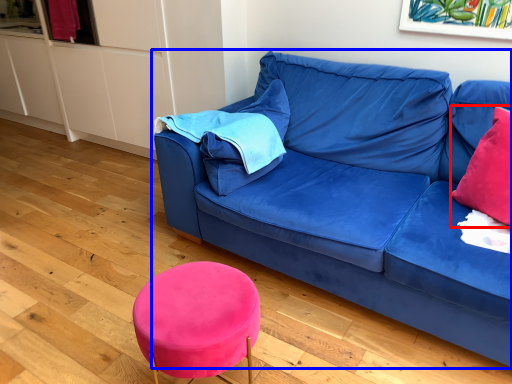
Question: Among these objects, which one is farthest to the camera, throw pillow (highlighted by a red box) or studio couch (highlighted by a blue box)?

Choices:
 (A) throw pillow
 (B) studio couch

Answer: (A)